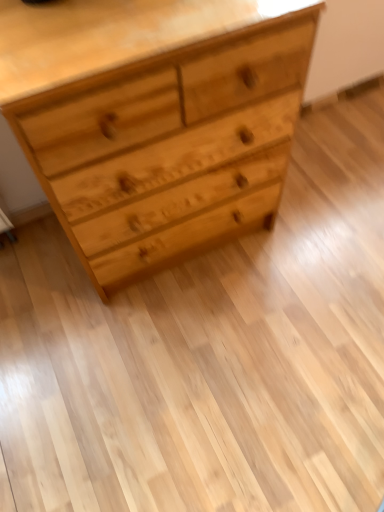
Question: Is natural wood chest of drawers at upper center inside the boundaries of natural wood drawer at center, or outside?

Choices:
 (A) outside
 (B) inside

Answer: (A)

Question: Considering the positions of natural wood chest of drawers at upper center and natural wood drawer at center in the image, is natural wood chest of drawers at upper center bigger or smaller than natural wood drawer at center?

Choices:
 (A) big
 (B) small

Answer: (A)

Question: In terms of width, does natural wood chest of drawers at upper center look wider or thinner when compared to natural wood drawer at center?

Choices:
 (A) wide
 (B) thin

Answer: (A)

Question: Considering the positions of natural wood drawer at center and natural wood chest of drawers at upper center in the image, is natural wood drawer at center wider or thinner than natural wood chest of drawers at upper center?

Choices:
 (A) thin
 (B) wide

Answer: (A)

Question: Is natural wood drawer at center in front of or behind natural wood chest of drawers at upper center in the image?

Choices:
 (A) front
 (B) behind

Answer: (B)

Question: From a real-world perspective, is natural wood drawer at center physically located above or below natural wood chest of drawers at upper center?

Choices:
 (A) above
 (B) below

Answer: (B)

Question: Does point (210, 165) appear closer or farther from the camera than point (193, 247)?

Choices:
 (A) farther
 (B) closer

Answer: (B)